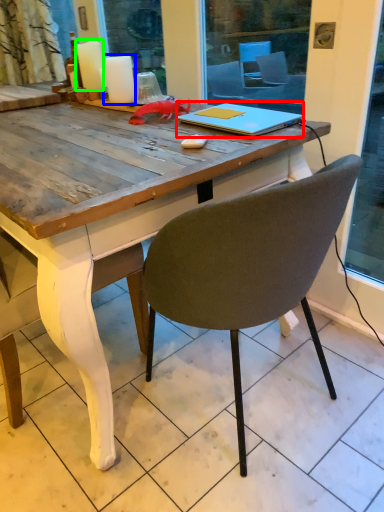
Question: Which object is the farthest from notebook (highlighted by a red box)? Choose among these: candle (highlighted by a blue box) or candle (highlighted by a green box).

Choices:
 (A) candle
 (B) candle

Answer: (B)